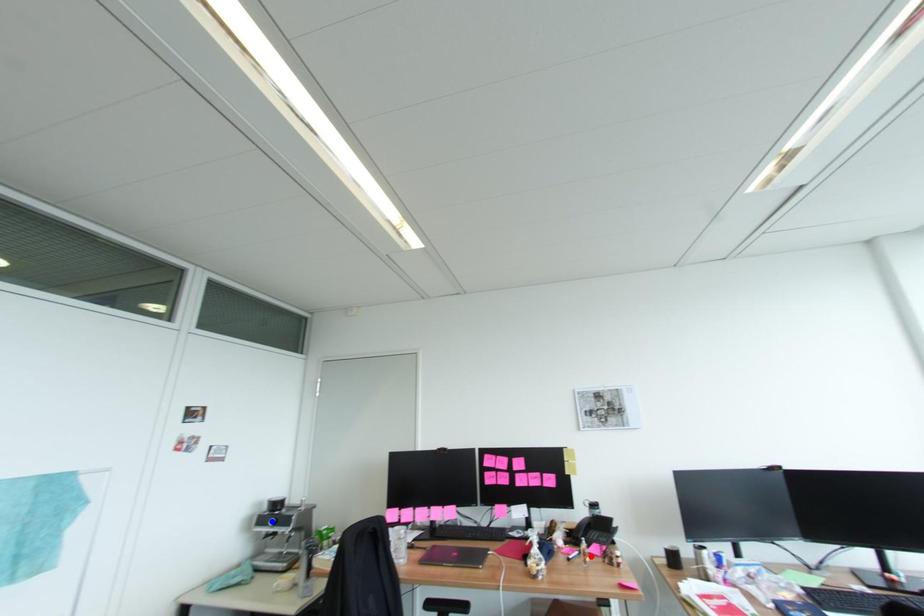
Question: Two points are marked on the image. Which point is closer to the camera?

Choices:
 (A) Blue point is closer.
 (B) Red point is closer.

Answer: (B)